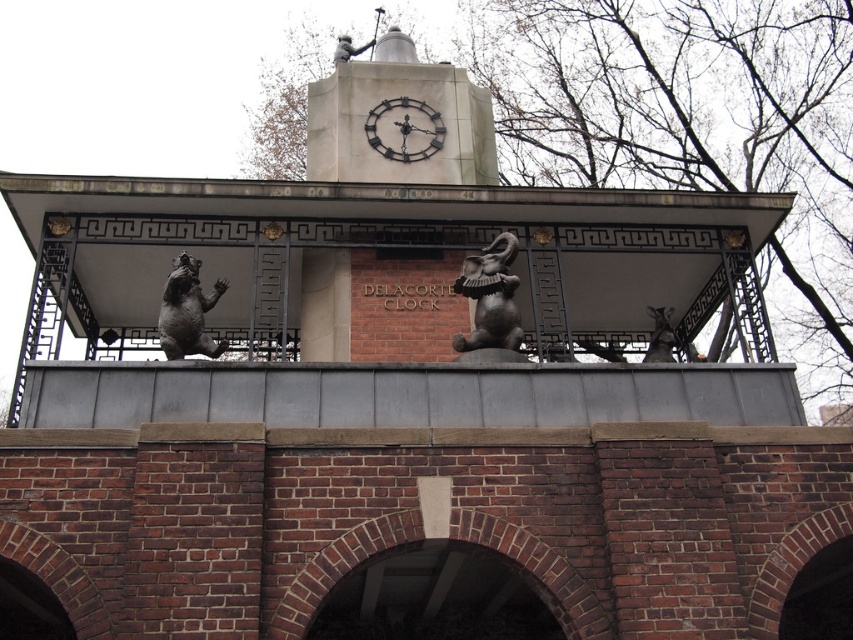
You are an artist planning to sketch the Delacorte Clock. You want to ensure the shiny bronze bear at upper left and the metallic clock at center are proportionally accurate. Based on their sizes, which object should you draw smaller?

The shiny bronze bear at upper left should be drawn smaller than the metallic clock at center because it has a smaller size compared to the metallic clock at center.

You are standing in front of the Delacorte Clock in Central Park. You notice two points marked on the structure. The first point is at coordinates point (190, 323) and the second is at point (410, 120). Which point is closer to you?

Point (190, 323) is in front of point (410, 120), so the first point is closer to you.